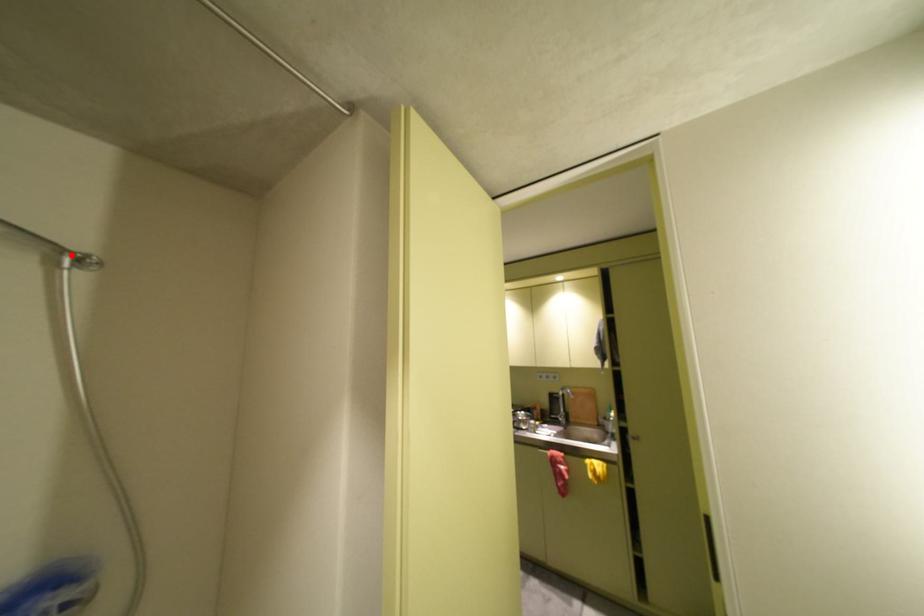
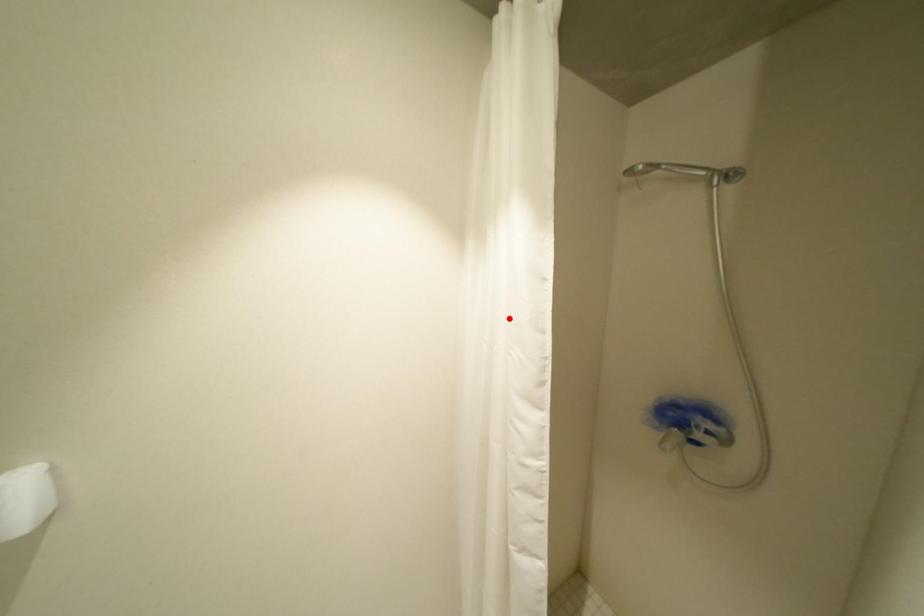
I am providing you with two images of the same scene from different viewpoints. A red point is marked on the first image and another point is marked on the second image. Do the highlighted points in image1 and image2 indicate the same real-world spot?

No